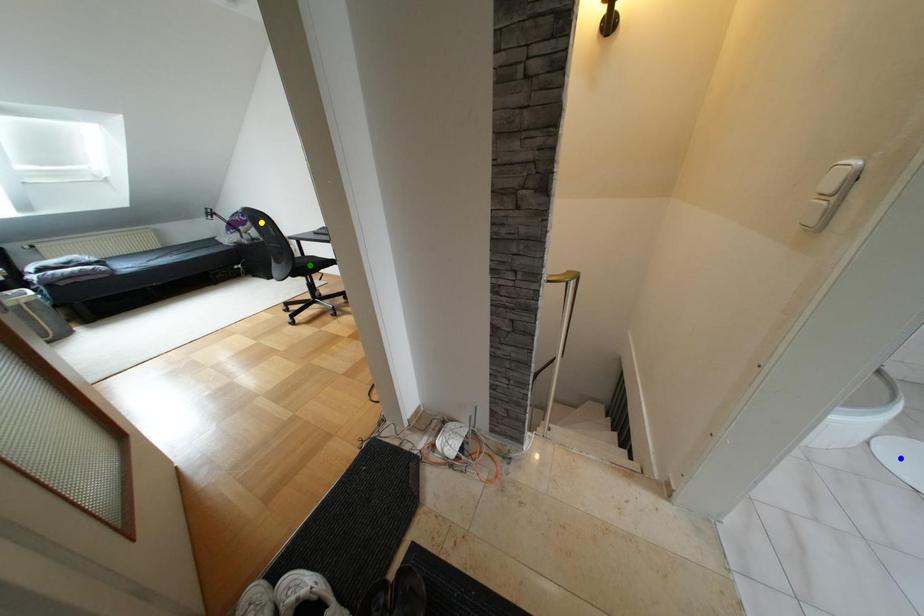
Order these from farthest to nearest:
1. blue point
2. green point
3. yellow point

green point, yellow point, blue point